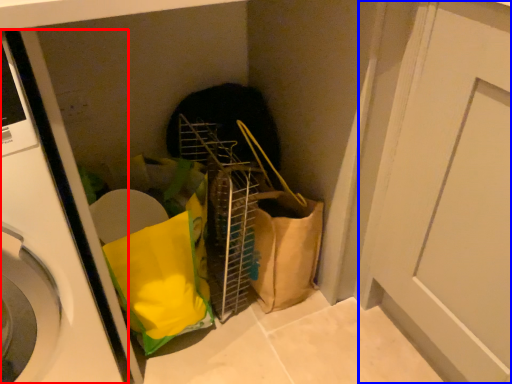
Question: Which object appears farthest to the camera in this image, washing machine (highlighted by a red box) or door (highlighted by a blue box)?

Choices:
 (A) washing machine
 (B) door

Answer: (B)